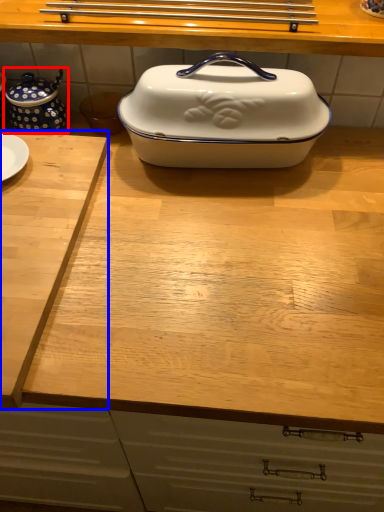
Question: Among these objects, which one is farthest to the camera, tea pot (highlighted by a red box) or cutting board (highlighted by a blue box)?

Choices:
 (A) tea pot
 (B) cutting board

Answer: (A)